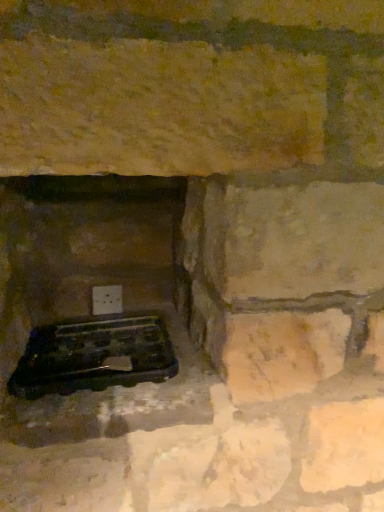
You are a GUI agent. You are given a task and a screenshot of the screen. Output one action in this format:
    pyautogui.click(x=<x>, y=<y>)
    Task: Click on the black plastic tray at lower left
    
    Given the screenshot: What is the action you would take?
    pyautogui.click(x=91, y=298)

This screenshot has height=512, width=384. What do you see at coordinates (91, 298) in the screenshot?
I see `black plastic tray at lower left` at bounding box center [91, 298].

Find the location of `black plastic tray at lower left`. black plastic tray at lower left is located at coordinates (91, 298).

In the scene shown: Is white plastic electric outlet at lower center at the back of black plastic grill at lower left?

Yes, black plastic grill at lower left is facing away from white plastic electric outlet at lower center.

Is black plastic grill at lower left at the right side of white plastic electric outlet at lower center?

Indeed, black plastic grill at lower left is positioned on the right side of white plastic electric outlet at lower center.

Is black plastic grill at lower left closer to camera compared to white plastic electric outlet at lower center?

Yes.

Where is `grill on the right of white plastic electric outlet at lower center`? The height and width of the screenshot is (512, 384). grill on the right of white plastic electric outlet at lower center is located at coordinates (94, 356).

In the scene shown: Between black plastic tray at lower left and white plastic electric outlet at lower center, which one has smaller size?

white plastic electric outlet at lower center.

Based on the photo, is black plastic tray at lower left to the left or to the right of white plastic electric outlet at lower center in the image?

black plastic tray at lower left is to the right of white plastic electric outlet at lower center.

Consider the image. Is black plastic tray at lower left next to white plastic electric outlet at lower center and touching it?

No, black plastic tray at lower left is not making contact with white plastic electric outlet at lower center.

Measure the distance from black plastic tray at lower left to white plastic electric outlet at lower center.

A distance of 9.99 inches exists between black plastic tray at lower left and white plastic electric outlet at lower center.

Considering the relative sizes of white plastic electric outlet at lower center and black plastic grill at lower left in the image provided, is white plastic electric outlet at lower center wider than black plastic grill at lower left?

No, white plastic electric outlet at lower center is not wider than black plastic grill at lower left.

Between point (120, 305) and point (81, 376), which one is positioned in front?

The point (81, 376) is closer.

Does white plastic electric outlet at lower center touch black plastic grill at lower left?

No, white plastic electric outlet at lower center is not touching black plastic grill at lower left.

What are the coordinates of `electric outlet above the black plastic grill at lower left (from the image's perspective)` in the screenshot? It's located at (107, 300).

Measure the distance between black plastic grill at lower left and black plastic tray at lower left.

They are 5.37 inches apart.

Locate an element on the screen. This screenshot has width=384, height=512. fireplace lying in front of the black plastic grill at lower left is located at coordinates (91, 298).

Is black plastic grill at lower left located outside black plastic tray at lower left?

Yes.

Is black plastic tray at lower left positioned beyond the bounds of black plastic grill at lower left?

Yes.

Considering the relative sizes of black plastic tray at lower left and black plastic grill at lower left in the image provided, is black plastic tray at lower left thinner than black plastic grill at lower left?

No.

How many degrees apart are the facing directions of black plastic tray at lower left and black plastic grill at lower left?

They differ by 0.00179 degrees in their facing directions.

Considering the positions of point (120, 303) and point (18, 440), is point (120, 303) closer or farther from the camera than point (18, 440)?

Point (120, 303).

Is black plastic tray at lower left at the back of white plastic electric outlet at lower center?

white plastic electric outlet at lower center does not have its back to black plastic tray at lower left.

From the image's perspective, which is below, white plastic electric outlet at lower center or black plastic tray at lower left?

black plastic tray at lower left is shown below in the image.

At what (x,y) coordinates should I click in order to perform the action: click on grill that is in front of the white plastic electric outlet at lower center. Please return your answer as a coordinate pair (x, y). Looking at the image, I should click on (94, 356).

Image resolution: width=384 pixels, height=512 pixels. Find the location of `fireplace that appears on the right of white plastic electric outlet at lower center`. fireplace that appears on the right of white plastic electric outlet at lower center is located at coordinates (91, 298).

Looking at the image, which one is located further to black plastic tray at lower left, black plastic grill at lower left or white plastic electric outlet at lower center?

The object further to black plastic tray at lower left is white plastic electric outlet at lower center.

Which object lies nearer to the anchor point black plastic tray at lower left, white plastic electric outlet at lower center or black plastic grill at lower left?

black plastic grill at lower left lies closer to black plastic tray at lower left than the other object.

When comparing their distances from black plastic grill at lower left, does black plastic tray at lower left or white plastic electric outlet at lower center seem further?

white plastic electric outlet at lower center.

Based on their spatial positions, is white plastic electric outlet at lower center or black plastic tray at lower left further from black plastic grill at lower left?

white plastic electric outlet at lower center is positioned further to the anchor black plastic grill at lower left.

Based on their spatial positions, is black plastic tray at lower left or black plastic grill at lower left closer to white plastic electric outlet at lower center?

black plastic tray at lower left is positioned closer to the anchor white plastic electric outlet at lower center.

Estimate the real-world distances between objects in this image. Which object is closer to white plastic electric outlet at lower center, black plastic grill at lower left or black plastic tray at lower left?

black plastic tray at lower left.

Locate an element on the screen. This screenshot has height=512, width=384. grill between black plastic tray at lower left and white plastic electric outlet at lower center from front to back is located at coordinates (94, 356).